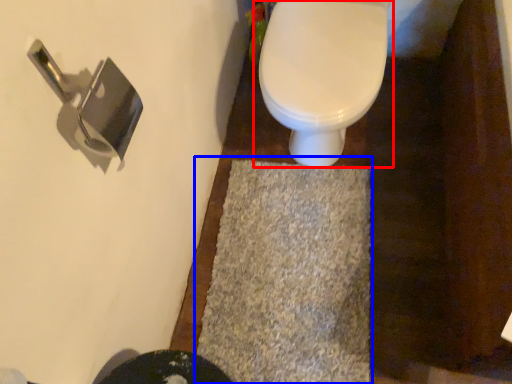
Question: Which of the following is the farthest to the observer, toilet (highlighted by a red box) or bath mat (highlighted by a blue box)?

Choices:
 (A) toilet
 (B) bath mat

Answer: (B)